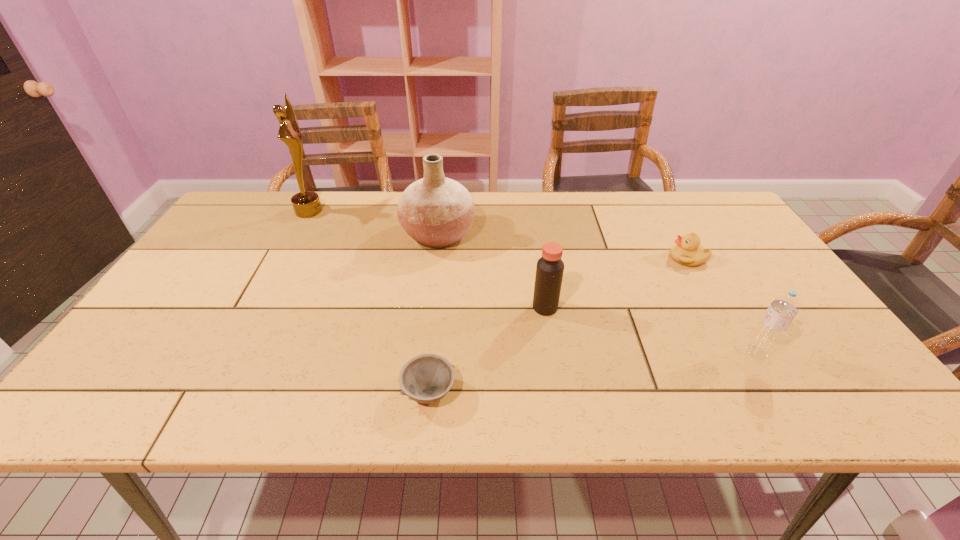
Where is `the tallest object`? The height and width of the screenshot is (540, 960). the tallest object is located at coordinates click(x=306, y=204).

This screenshot has width=960, height=540. In order to click on the leftmost object in this screenshot , I will do `click(306, 204)`.

Identify the location of pottery. (436, 211).

Find the location of a particular element. This screenshot has height=540, width=960. the third object from right to left is located at coordinates (549, 272).

The image size is (960, 540). I want to click on the third nearest object, so click(x=549, y=272).

Image resolution: width=960 pixels, height=540 pixels. In order to click on water bottle in this screenshot , I will do `click(773, 325)`.

The image size is (960, 540). In order to click on the fifth tallest object in this screenshot , I will do click(x=687, y=251).

This screenshot has height=540, width=960. I want to click on the nearest object, so [x=426, y=378].

I want to click on bowl, so click(426, 378).

What are the coordinates of `free space located 0.380m on the front-facing side of the tallest object` in the screenshot? It's located at (439, 211).